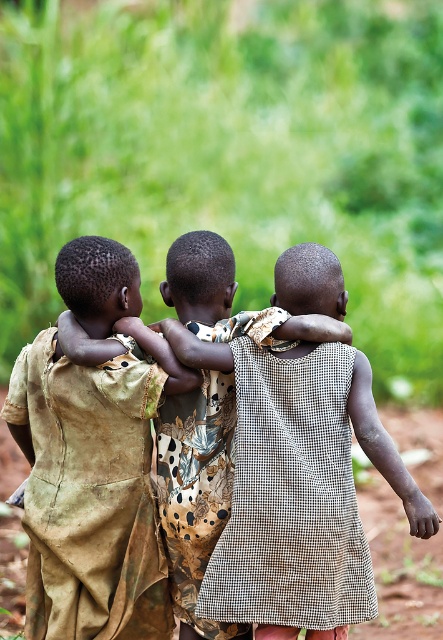
You are a photographer trying to capture the three children in the scene. You notice the checkered fabric dress at center and the brown dirt field at lower center. Which object is wider in the image?

The checkered fabric dress at center is wider than the brown dirt field at lower center according to the description.

You are an observer looking at the scene of three children walking away from you. You notice two items of clothing at the center of the image. Which one is located to the left of the other? The items are the brown textured cloth at center and the checkered fabric dress at center.

The brown textured cloth at center is positioned on the left side of checkered fabric dress at center.